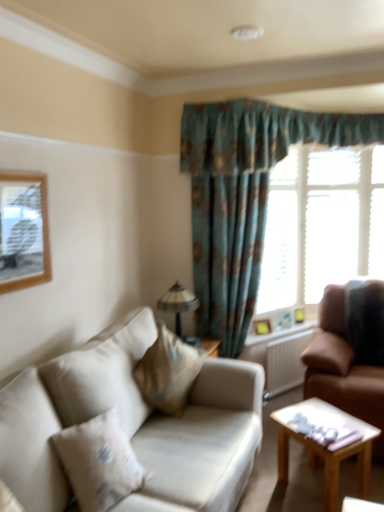
Question: Is beige fabric pillow at lower left, which is counted as the 2th pillow, starting from the right, to the right of white plastic radiator at lower right from the viewer's perspective?

Choices:
 (A) no
 (B) yes

Answer: (A)

Question: Is beige fabric pillow at lower left, which is counted as the second pillow, starting from the back, looking in the opposite direction of white plastic radiator at lower right?

Choices:
 (A) yes
 (B) no

Answer: (B)

Question: Could you tell me if beige fabric pillow at lower left, which is counted as the first pillow, starting from the front, is turned towards white plastic radiator at lower right?

Choices:
 (A) yes
 (B) no

Answer: (B)

Question: Considering the relative sizes of beige fabric pillow at lower left, which is counted as the second pillow, starting from the back, and white plastic radiator at lower right in the image provided, is beige fabric pillow at lower left, which is counted as the second pillow, starting from the back, smaller than white plastic radiator at lower right?

Choices:
 (A) yes
 (B) no

Answer: (B)

Question: Is beige fabric pillow at lower left, which is the 1th pillow in left-to-right order, not near white plastic radiator at lower right?

Choices:
 (A) yes
 (B) no

Answer: (A)

Question: Is beige fabric pillow at lower left, which is counted as the first pillow, starting from the front, located outside white plastic radiator at lower right?

Choices:
 (A) no
 (B) yes

Answer: (B)

Question: Considering the relative sizes of matte glass lampshade at center and beige fabric couch at lower left, arranged as the 2th studio couch when viewed from the right, in the image provided, is matte glass lampshade at center taller than beige fabric couch at lower left, arranged as the 2th studio couch when viewed from the right,?

Choices:
 (A) no
 (B) yes

Answer: (A)

Question: Does matte glass lampshade at center have a lesser width compared to beige fabric couch at lower left, which is counted as the 1th studio couch, starting from the left?

Choices:
 (A) no
 (B) yes

Answer: (B)

Question: Is matte glass lampshade at center in front of beige fabric couch at lower left, arranged as the 2th studio couch when viewed from the right?

Choices:
 (A) yes
 (B) no

Answer: (B)

Question: From a real-world perspective, is matte glass lampshade at center beneath beige fabric couch at lower left, arranged as the 2th studio couch when viewed from the right?

Choices:
 (A) yes
 (B) no

Answer: (B)

Question: Does matte glass lampshade at center have a lesser height compared to beige fabric couch at lower left, which is counted as the 1th studio couch, starting from the left?

Choices:
 (A) no
 (B) yes

Answer: (B)

Question: Is matte glass lampshade at center facing towards beige fabric couch at lower left, arranged as the 2th studio couch when viewed from the right?

Choices:
 (A) yes
 (B) no

Answer: (B)

Question: Is wooden picture frame at right, the 1th picture frame when ordered from bottom to top, bigger than matte glass lampshade at center?

Choices:
 (A) yes
 (B) no

Answer: (B)